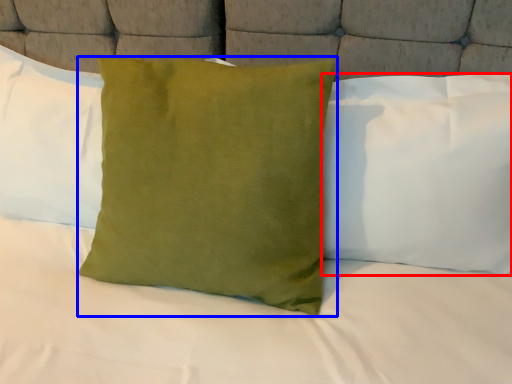
Question: Which point is further to the camera, pillow (highlighted by a red box) or pillow (highlighted by a blue box)?

Choices:
 (A) pillow
 (B) pillow

Answer: (A)